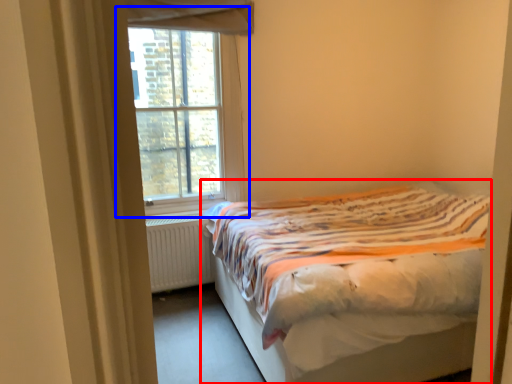
Question: Which point is further to the camera, bed (highlighted by a red box) or window (highlighted by a blue box)?

Choices:
 (A) bed
 (B) window

Answer: (B)